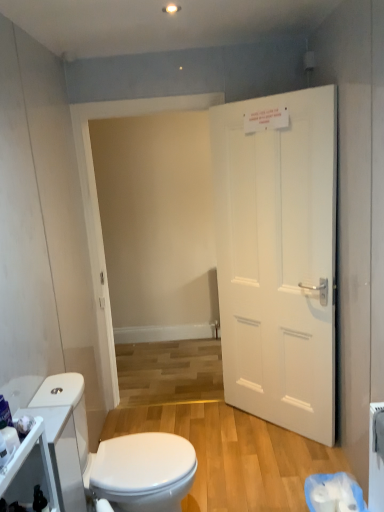
Question: Do you think white glossy toilet at lower left is within white glossy cabinet at lower left, or outside of it?

Choices:
 (A) inside
 (B) outside

Answer: (B)

Question: From the image's perspective, is white glossy toilet at lower left located above or below white glossy cabinet at lower left?

Choices:
 (A) below
 (B) above

Answer: (A)

Question: Which of these objects is positioned closest to the white plastic toilet paper at lower right?

Choices:
 (A) white glossy toilet at lower left
 (B) white glossy cabinet at lower left
 (C) white matte door at right

Answer: (A)

Question: Estimate the real-world distances between objects in this image. Which object is closer to the white glossy cabinet at lower left?

Choices:
 (A) white glossy toilet at lower left
 (B) white matte door at right
 (C) white plastic toilet paper at lower right

Answer: (A)